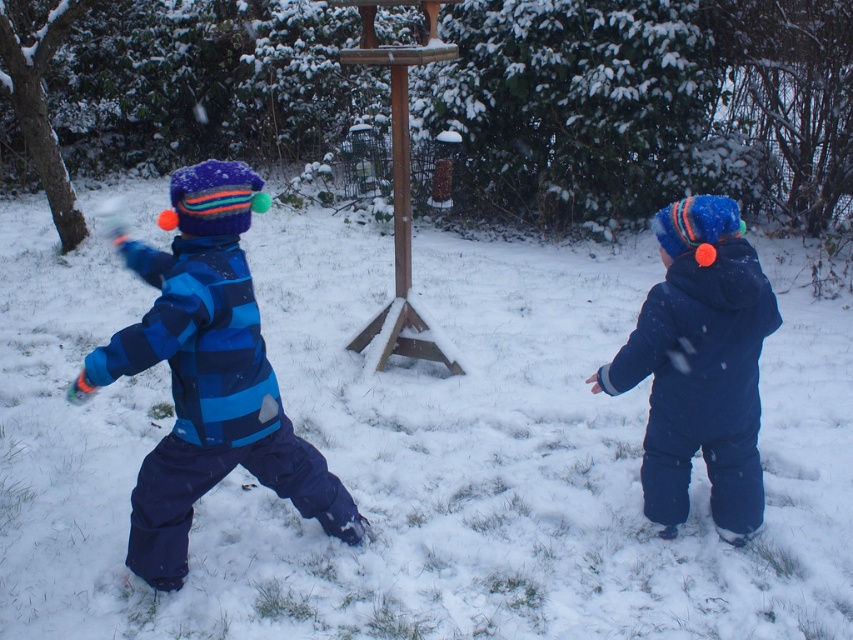
Question: Considering the real-world distances, which object is farthest from the matte blue snowsuit at right?

Choices:
 (A) wooden bird feeder at center
 (B) blue striped snowsuit at left

Answer: (A)

Question: Which point is farther from the camera taking this photo?

Choices:
 (A) pos(779,321)
 (B) pos(148,268)
 (C) pos(374,10)

Answer: (C)

Question: Does matte blue snowsuit at right have a greater width compared to wooden bird feeder at center?

Choices:
 (A) yes
 (B) no

Answer: (B)

Question: Estimate the real-world distances between objects in this image. Which object is closer to the matte blue snowsuit at right?

Choices:
 (A) wooden bird feeder at center
 (B) blue striped snowsuit at left

Answer: (B)

Question: Is the position of matte blue snowsuit at right more distant than that of wooden bird feeder at center?

Choices:
 (A) no
 (B) yes

Answer: (A)

Question: Where is blue striped snowsuit at left located in relation to wooden bird feeder at center in the image?

Choices:
 (A) above
 (B) below

Answer: (B)